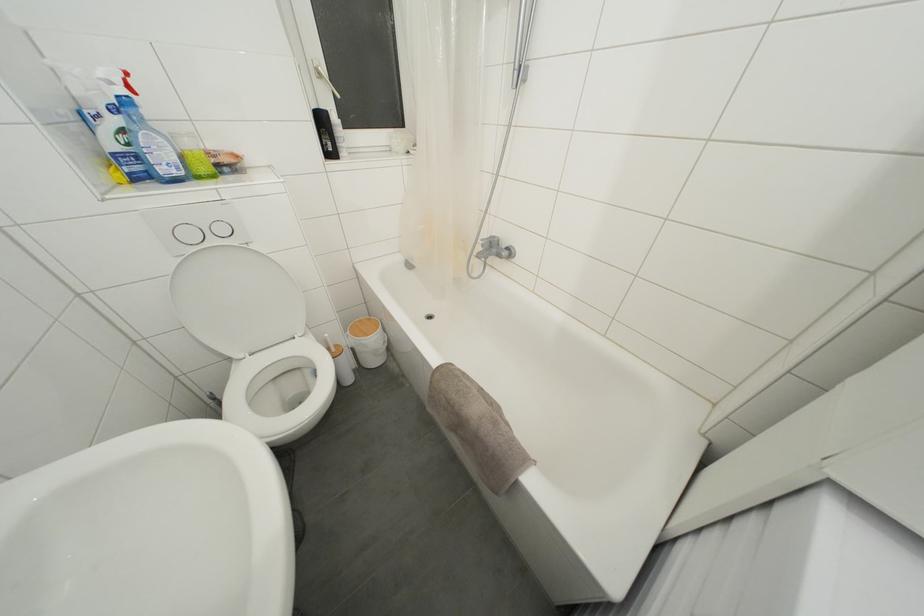
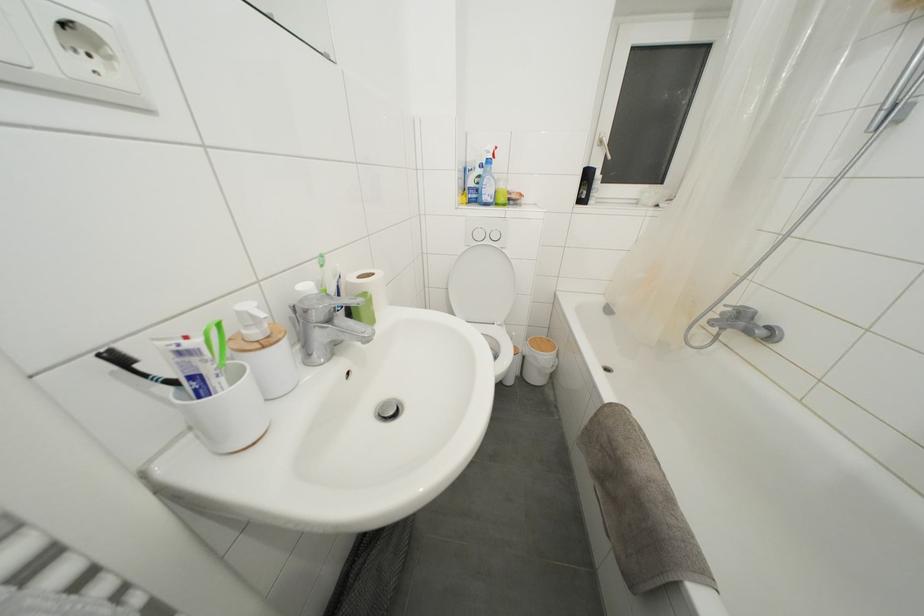
The point at (168, 175) is marked in the first image. Where is the corresponding point in the second image?

(490, 203)